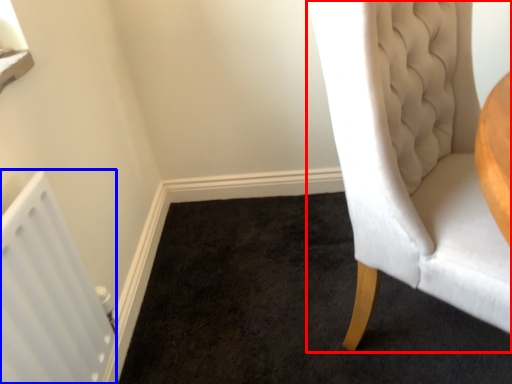
Question: Which point is closer to the camera, chair (highlighted by a red box) or radiator (highlighted by a blue box)?

Choices:
 (A) chair
 (B) radiator

Answer: (A)